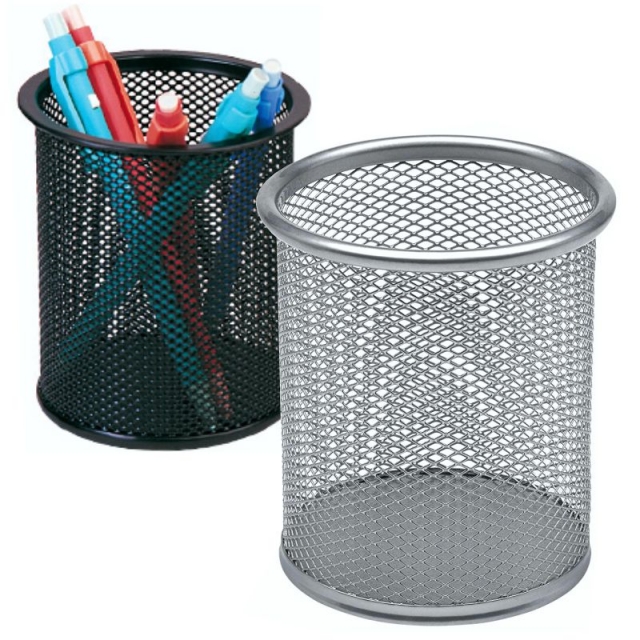
The image size is (640, 640). What are the coordinates of `pen` in the screenshot? It's located at (68, 72), (100, 80), (170, 125), (224, 125), (269, 98).